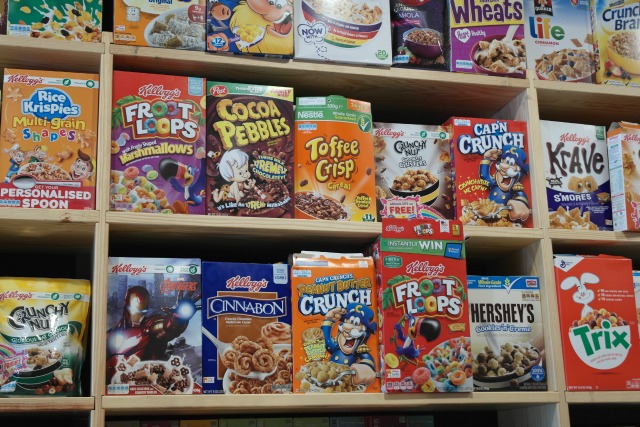
Find the location of `boxes of cereal on the 2nd highest shelf`. boxes of cereal on the 2nd highest shelf is located at coordinates (52, 134), (156, 142), (243, 149), (340, 156), (406, 163), (486, 169), (577, 180), (625, 179).